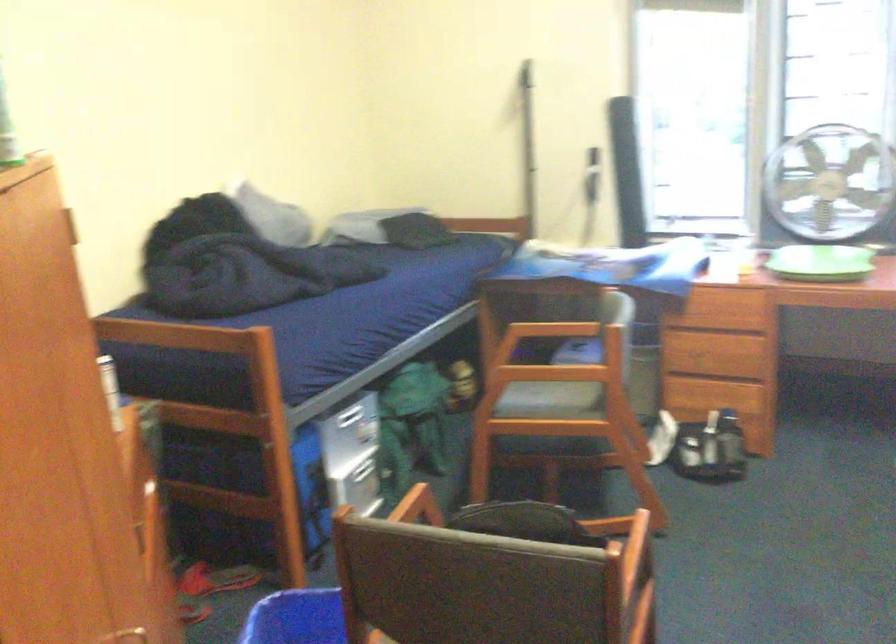
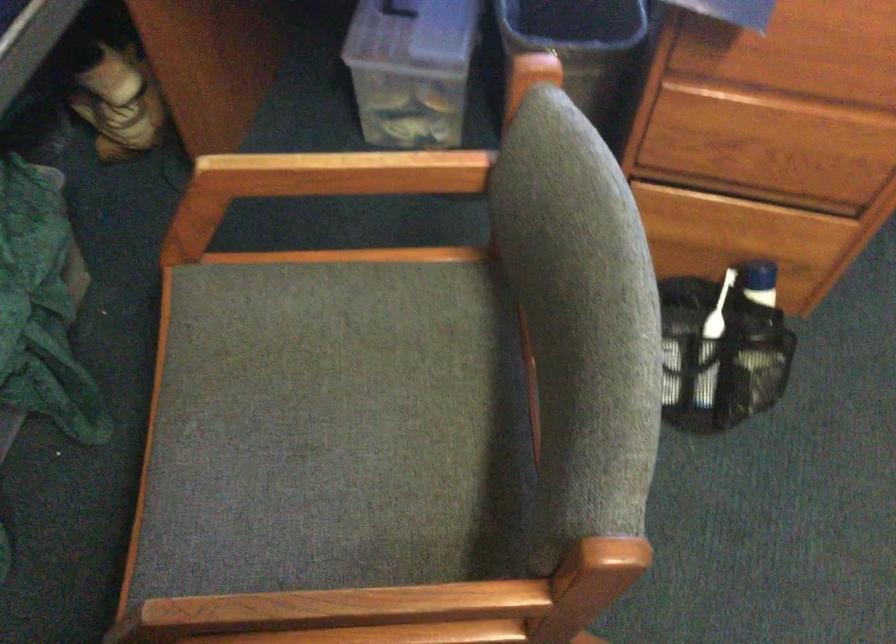
Where in the second image is the point corresponding to [549,328] from the first image?

(336, 174)